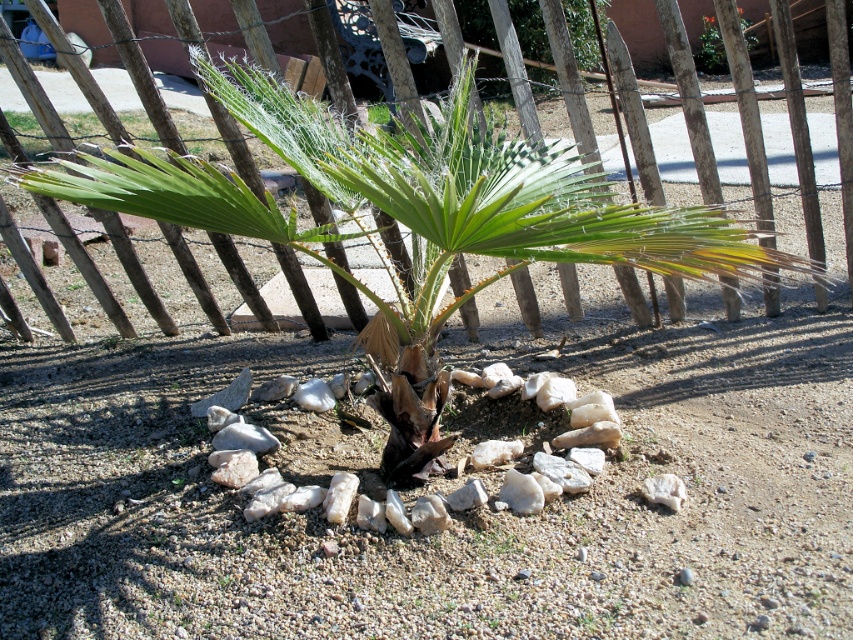
Question: Is wooden at center to the left of green leafy plant at upper center from the viewer's perspective?

Choices:
 (A) yes
 (B) no

Answer: (A)

Question: Does wooden at center appear on the left side of green leafy plant at upper center?

Choices:
 (A) no
 (B) yes

Answer: (B)

Question: Among these points, which one is farthest from the camera?

Choices:
 (A) (712, 65)
 (B) (666, 144)

Answer: (A)

Question: Is wooden at center thinner than green leafy plant at upper center?

Choices:
 (A) no
 (B) yes

Answer: (A)

Question: Which point is farther to the camera?

Choices:
 (A) wooden at center
 (B) green leafy plant at upper center

Answer: (B)